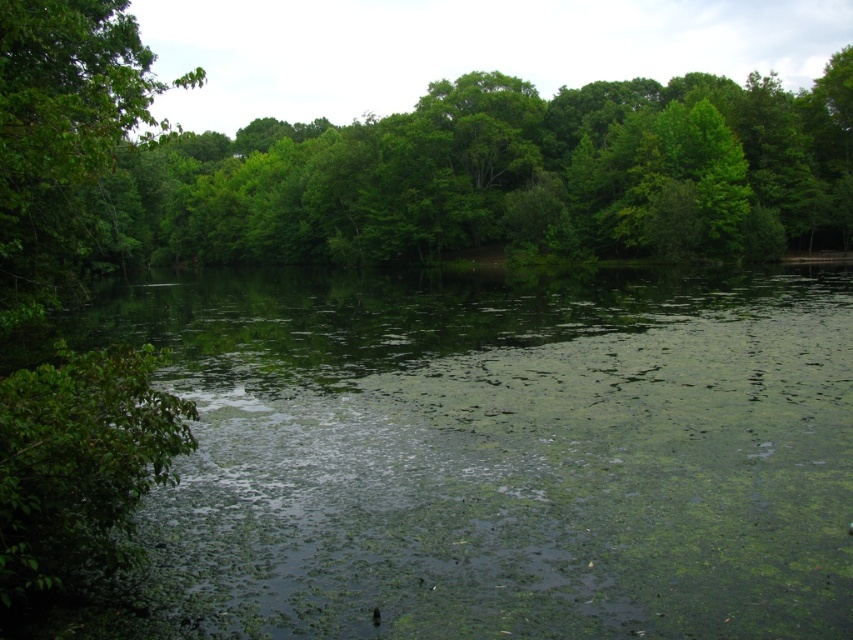
Question: Can you confirm if green algae-covered water at center is positioned below green leafy tree at left?

Choices:
 (A) no
 (B) yes

Answer: (B)

Question: Which point is closer to the camera taking this photo?

Choices:
 (A) (582, 480)
 (B) (35, 193)

Answer: (A)

Question: Can you confirm if green leafy forest at center is smaller than green leafy tree at left?

Choices:
 (A) yes
 (B) no

Answer: (B)

Question: Which point is farther from the camera taking this photo?

Choices:
 (A) (42, 278)
 (B) (672, 547)

Answer: (A)

Question: Estimate the real-world distances between objects in this image. Which object is closer to the green leafy forest at center?

Choices:
 (A) green leafy tree at left
 (B) green algae-covered water at center

Answer: (A)

Question: Does green algae-covered water at center appear on the left side of green leafy forest at center?

Choices:
 (A) no
 (B) yes

Answer: (B)